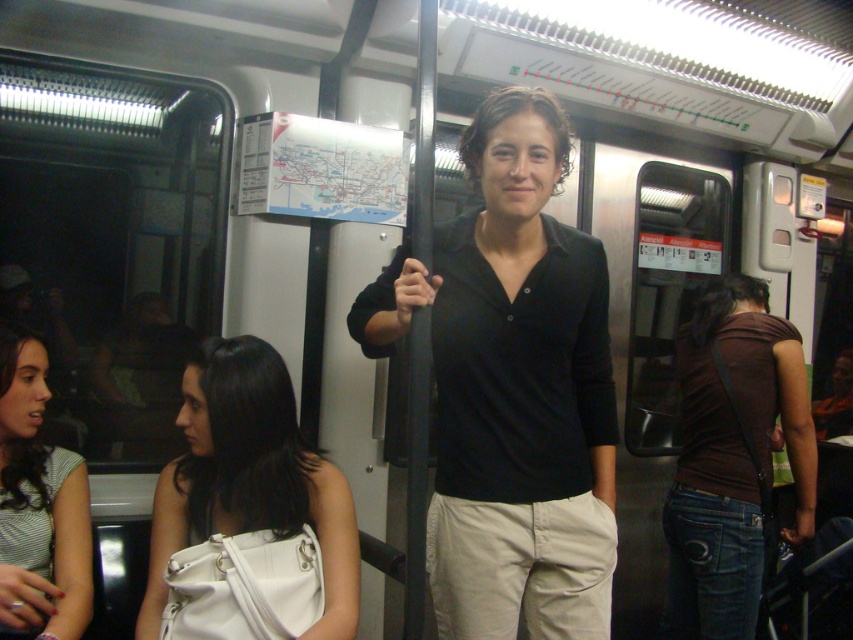
Between brown matte shirt at center and striped fabric shirt at lower left, which one appears on the left side from the viewer's perspective?

striped fabric shirt at lower left is more to the left.

Can you confirm if brown matte shirt at center is smaller than striped fabric shirt at lower left?

Actually, brown matte shirt at center might be larger than striped fabric shirt at lower left.

What do you see at coordinates (732, 458) in the screenshot?
I see `brown matte shirt at center` at bounding box center [732, 458].

Locate an element on the screen. The image size is (853, 640). brown matte shirt at center is located at coordinates (732, 458).

Which is above, black matte shirt at center or white matte bag at center left?

black matte shirt at center is above.

Does black matte shirt at center have a lesser width compared to white matte bag at center left?

Incorrect, black matte shirt at center's width is not less than white matte bag at center left's.

Is point (566, 346) positioned in front of point (309, 625)?

No, it is not.

This screenshot has width=853, height=640. I want to click on black matte shirt at center, so click(512, 388).

Does white matte bag at center left have a larger size compared to brown matte shirt at center?

No.

Who is positioned more to the right, white matte bag at center left or brown matte shirt at center?

From the viewer's perspective, brown matte shirt at center appears more on the right side.

Is point (221, 502) behind point (726, 362)?

No, it is in front of (726, 362).

At what (x,y) coordinates should I click in order to perform the action: click on white matte bag at center left. Please return your answer as a coordinate pair (x, y). Looking at the image, I should click on (248, 513).